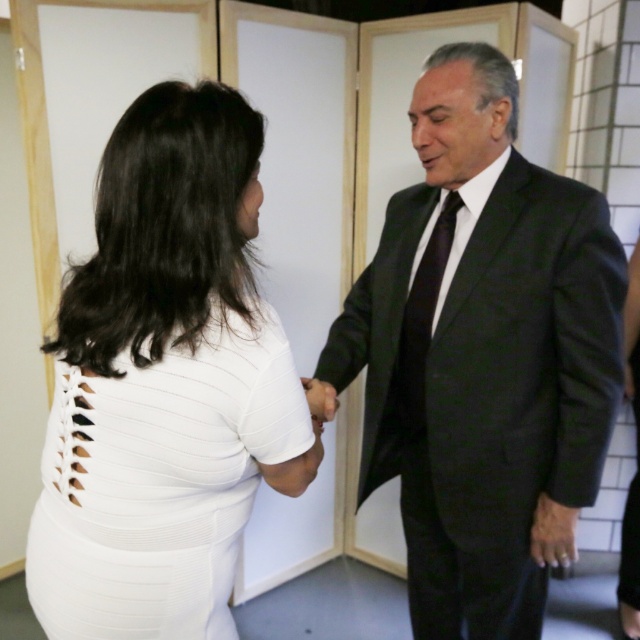
You are standing in the room and want to move from the white textured dress at left to the white matte hand at center. Which direction should you move to reach the hand?

You should move to the right to reach the white matte hand at center from the white textured dress at left, since the dress is to the left of the hand.